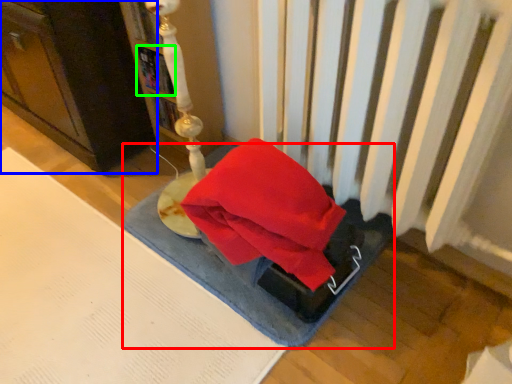
Question: Considering the real-world distances, which object is farthest from yoga mat (highlighted by a red box)? furniture (highlighted by a blue box) or book (highlighted by a green box)?

Choices:
 (A) furniture
 (B) book

Answer: (B)